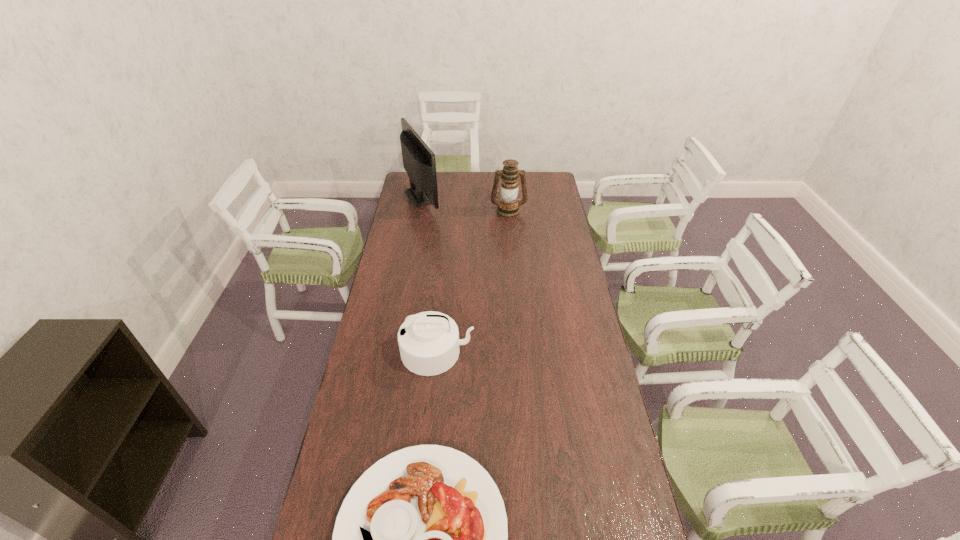
Locate an element on the screen. This screenshot has width=960, height=540. computer monitor is located at coordinates (419, 162).

The image size is (960, 540). Identify the location of lantern. (508, 207).

You are a GUI agent. You are given a task and a screenshot of the screen. Output one action in this format:
    pyautogui.click(x=<x>, y=<y>)
    Task: Click on the third farthest object
    
    Given the screenshot: What is the action you would take?
    pyautogui.click(x=429, y=342)

This screenshot has height=540, width=960. Find the location of `kettle`. kettle is located at coordinates (429, 342).

Find the location of a particular element. This screenshot has height=540, width=960. blank area located 0.210m on the front-facing side of the tallest object is located at coordinates (480, 196).

Locate an element on the screen. The height and width of the screenshot is (540, 960). vacant area situated on the back of the third shortest object is located at coordinates (506, 187).

The width and height of the screenshot is (960, 540). I want to click on vacant space situated 0.300m on the spout of the third farthest object, so click(428, 460).

This screenshot has width=960, height=540. In order to click on object present at the far edge in this screenshot , I will do `click(419, 162)`.

Identify the location of computer monitor located in the left edge section of the desktop. This screenshot has height=540, width=960. (419, 162).

This screenshot has height=540, width=960. In order to click on kettle located at the left edge in this screenshot , I will do `click(429, 342)`.